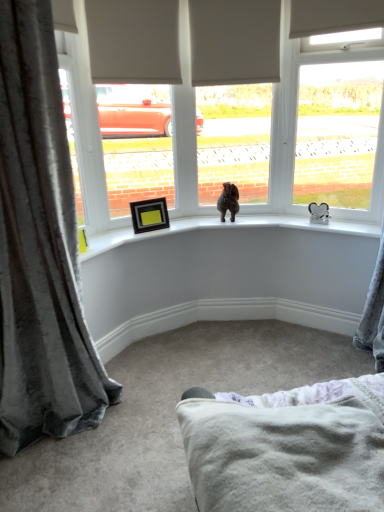
Image resolution: width=384 pixels, height=512 pixels. I want to click on vacant space to the right of black matte picture frame at upper left, so click(173, 226).